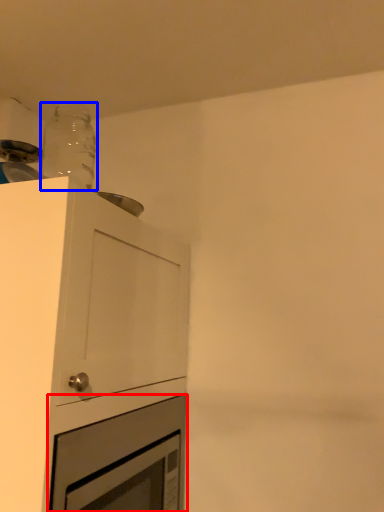
Question: Which of the following is the closest to the observer, oven (highlighted by a red box) or bottle (highlighted by a blue box)?

Choices:
 (A) oven
 (B) bottle

Answer: (A)